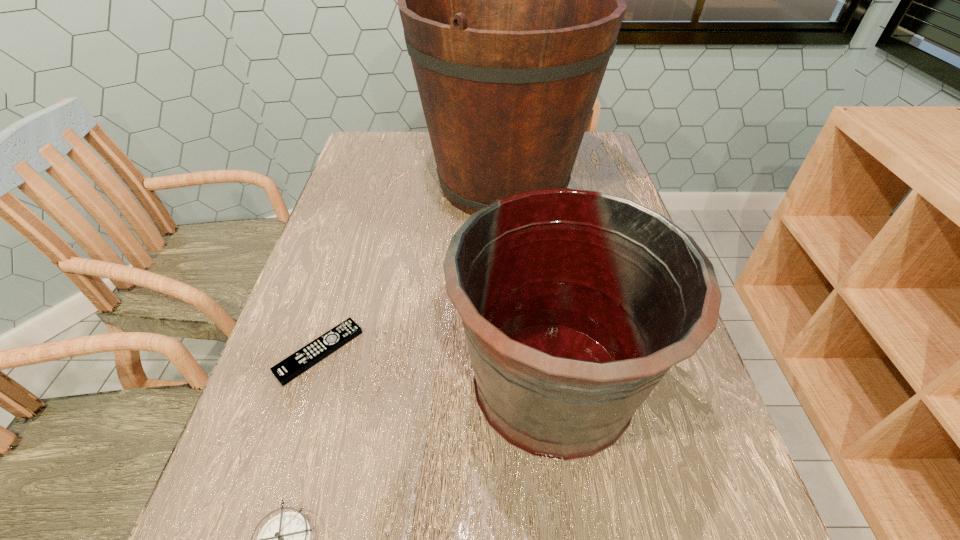
Where is `object that is at the far right corner`? The image size is (960, 540). object that is at the far right corner is located at coordinates (511, 0).

At what (x,y) coordinates should I click in order to perform the action: click on vacant area at the left edge. Please return your answer as a coordinate pair (x, y). The height and width of the screenshot is (540, 960). Looking at the image, I should click on (235, 527).

Identify the location of free space at the right edge of the desktop. The image size is (960, 540). (687, 498).

The image size is (960, 540). Identify the location of vacant position at the far left corner of the desktop. (383, 144).

Identify the location of blank region between the shortest object and the farther bucket. (411, 268).

Image resolution: width=960 pixels, height=540 pixels. In order to click on free space between the taller bucket and the remote control in this screenshot , I will do `click(411, 268)`.

Locate an element on the screen. object that can be found as the third closest to the farthest object is located at coordinates (287, 539).

Identify which object is the second closest to the farthest object. Please provide its 2D coordinates. Your answer should be formatted as a tuple, i.e. [(x, y)], where the tuple contains the x and y coordinates of a point satisfying the conditions above.

[(291, 367)]

Locate an element on the screen. This screenshot has height=540, width=960. vacant position in the image that satisfies the following two spatial constraints: 1. on the back side of the tallest object; 2. on the left side of the shortest object is located at coordinates (372, 184).

At what (x,y) coordinates should I click in order to perform the action: click on vacant region that satisfies the following two spatial constraints: 1. on the back side of the farther bucket; 2. on the left side of the remote control. Please return your answer as a coordinate pair (x, y). The width and height of the screenshot is (960, 540). Looking at the image, I should click on (372, 184).